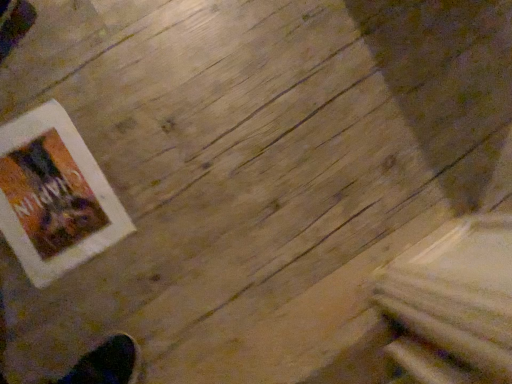
Where is `vacant area on top of white matte picture frame at lower left (from a real-world perspective)`? This screenshot has width=512, height=384. vacant area on top of white matte picture frame at lower left (from a real-world perspective) is located at coordinates (48, 188).